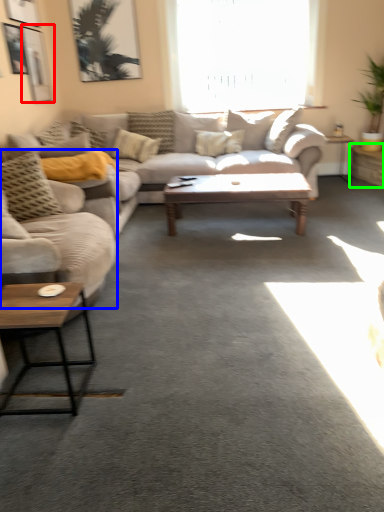
Question: Considering the real-world distances, which object is closest to picture frame (highlighted by a red box)? studio couch (highlighted by a blue box) or table (highlighted by a green box).

Choices:
 (A) studio couch
 (B) table

Answer: (A)